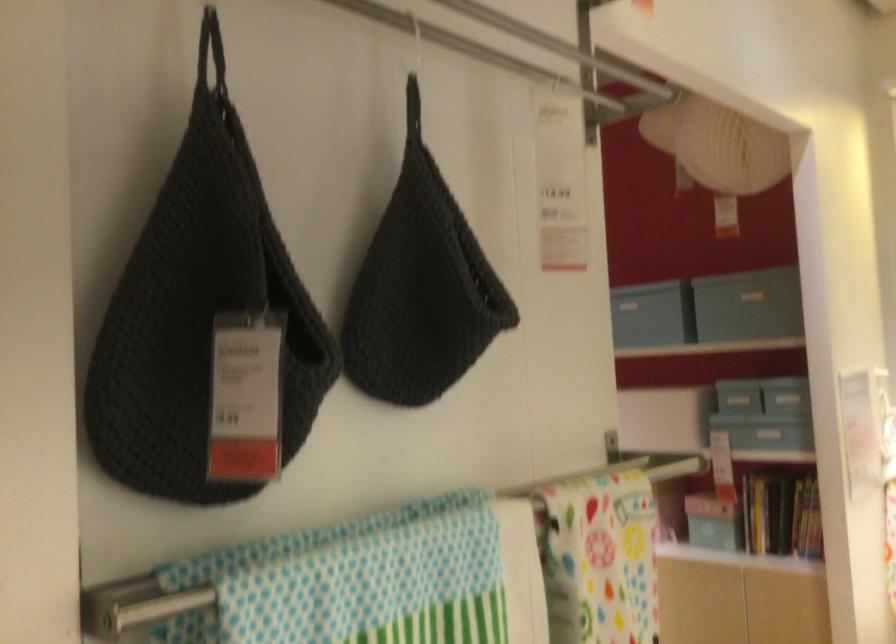
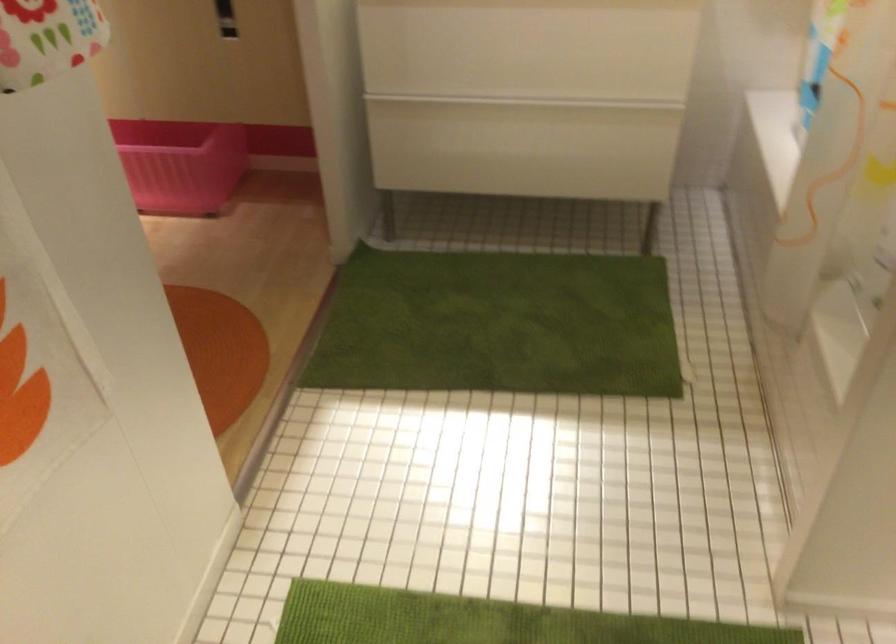
Based on the continuous images, in which direction is the camera rotating?

The camera's rotation is toward right-down.